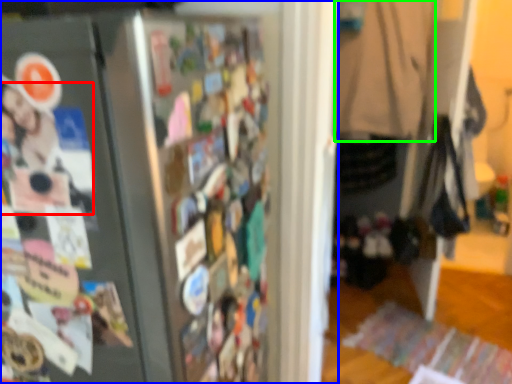
Question: Estimate the real-world distances between objects in this image. Which object is closer to person (highlighted by a red box), refrigerator (highlighted by a blue box) or clothing (highlighted by a green box)?

Choices:
 (A) refrigerator
 (B) clothing

Answer: (A)